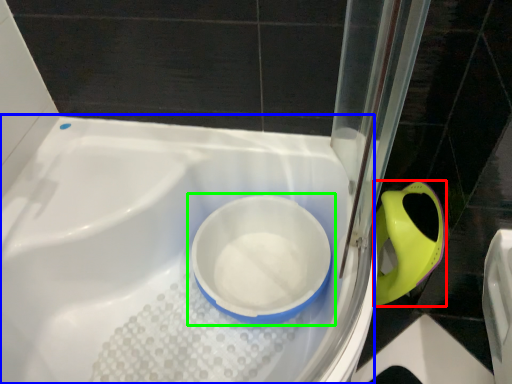
Question: Which is nearer to the bidet (highlighted by a red box)? bath (highlighted by a blue box) or toilet (highlighted by a green box).

Choices:
 (A) bath
 (B) toilet

Answer: (B)